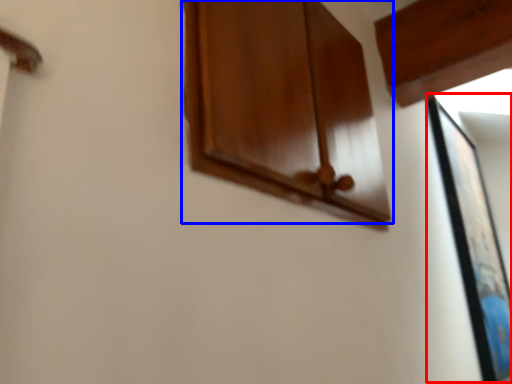
Question: Among these objects, which one is nearest to the camera, picture frame (highlighted by a red box) or cabinetry (highlighted by a blue box)?

Choices:
 (A) picture frame
 (B) cabinetry

Answer: (B)